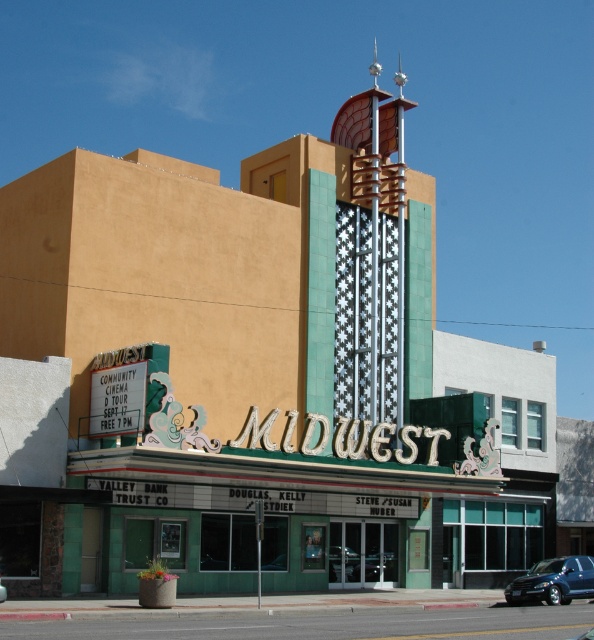
Question: From the image, what is the correct spatial relationship of metallic blue suv at center in relation to metallic blue car at center?

Choices:
 (A) right
 (B) left

Answer: (A)

Question: Which object is farther from the camera taking this photo?

Choices:
 (A) metallic blue suv at center
 (B) metallic blue car at center

Answer: (A)

Question: Is metallic blue suv at center to the right of metallic blue car at center from the viewer's perspective?

Choices:
 (A) yes
 (B) no

Answer: (A)

Question: Which of the following is the farthest from the observer?

Choices:
 (A) metallic blue suv at center
 (B) metallic blue car at center

Answer: (A)

Question: Can you confirm if metallic blue suv at center is positioned above metallic blue car at center?

Choices:
 (A) yes
 (B) no

Answer: (B)

Question: Which object appears farthest from the camera in this image?

Choices:
 (A) metallic blue car at center
 (B) metallic blue suv at center

Answer: (B)